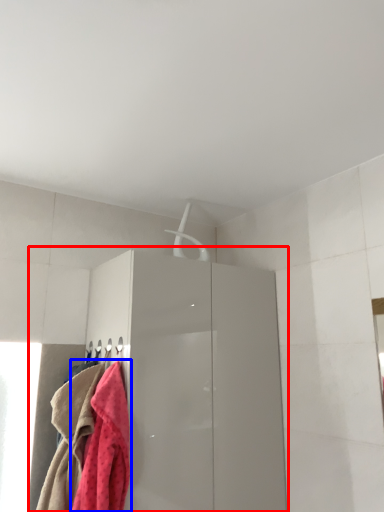
Question: Which point is closer to the camera, dresser (highlighted by a red box) or towel (highlighted by a blue box)?

Choices:
 (A) dresser
 (B) towel

Answer: (B)